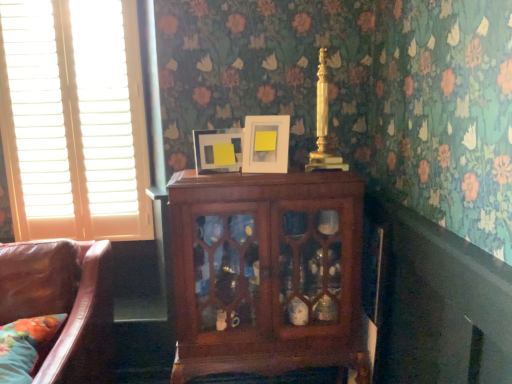
The height and width of the screenshot is (384, 512). What are the coordinates of `matte white picture frame at upper center, which is counted as the 1th picture frame, starting from the right` in the screenshot? It's located at (266, 144).

What is the approximate width of floral fabric pillow at lower left?

floral fabric pillow at lower left is 16.27 inches in width.

Measure the distance between point (311, 163) and camera.

A distance of 1.54 meters exists between point (311, 163) and camera.

What is the approximate width of gold polished candle holder at upper center?

It is 2.46 inches.

Identify the location of mahogany cabinet at center. (266, 272).

Where is `white wood blinds at left`? This screenshot has height=384, width=512. white wood blinds at left is located at coordinates (74, 119).

Consider the image. Does matte white picture frame at upper center, the 2th picture frame viewed from the left, have a lesser width compared to gold polished candle holder at upper center?

Incorrect, the width of matte white picture frame at upper center, the 2th picture frame viewed from the left, is not less than that of gold polished candle holder at upper center.

Is matte white picture frame at upper center, which is counted as the 1th picture frame, starting from the right, inside or outside of gold polished candle holder at upper center?

matte white picture frame at upper center, which is counted as the 1th picture frame, starting from the right, lies outside gold polished candle holder at upper center.

Considering the sizes of objects matte white picture frame at upper center, which is counted as the 1th picture frame, starting from the right, and gold polished candle holder at upper center in the image provided, who is taller, matte white picture frame at upper center, which is counted as the 1th picture frame, starting from the right, or gold polished candle holder at upper center?

gold polished candle holder at upper center.

Which is closer, (x=274, y=148) or (x=190, y=234)?

Point (x=274, y=148) appears to be farther away from the viewer than point (x=190, y=234).

Considering the relative positions of matte white picture frame at upper center, the 2th picture frame viewed from the left, and mahogany cabinet at center in the image provided, is matte white picture frame at upper center, the 2th picture frame viewed from the left, behind mahogany cabinet at center?

Yes, the depth of matte white picture frame at upper center, the 2th picture frame viewed from the left, is greater than that of mahogany cabinet at center.

Does matte white picture frame at upper center, which is counted as the 1th picture frame, starting from the right, have a larger size compared to mahogany cabinet at center?

Actually, matte white picture frame at upper center, which is counted as the 1th picture frame, starting from the right, might be smaller than mahogany cabinet at center.

Does matte white picture frame at upper center, which is counted as the 1th picture frame, starting from the right, have a greater width compared to mahogany cabinet at center?

No.

Does gold polished candle holder at upper center have a lesser width compared to matte white picture frame at upper center, which is counted as the 1th picture frame, starting from the right?

Yes, gold polished candle holder at upper center is thinner than matte white picture frame at upper center, which is counted as the 1th picture frame, starting from the right.

Looking at the image, does gold polished candle holder at upper center seem bigger or smaller compared to matte white picture frame at upper center, the 2th picture frame viewed from the left?

Considering their sizes, gold polished candle holder at upper center takes up less space than matte white picture frame at upper center, the 2th picture frame viewed from the left.

What's the angular difference between gold polished candle holder at upper center and matte white picture frame at upper center, the 2th picture frame viewed from the left,'s facing directions?

17.2 degrees.

Is point (323, 160) closer to camera compared to point (279, 167)?

That is False.

Between point (1, 361) and point (353, 324), which one is positioned in front?

The point (1, 361) is more forward.

Considering the relative positions of floral fabric pillow at lower left and mahogany cabinet at center in the image provided, is floral fabric pillow at lower left behind mahogany cabinet at center?

No.

In terms of width, does floral fabric pillow at lower left look wider or thinner when compared to mahogany cabinet at center?

Considering their sizes, floral fabric pillow at lower left looks broader than mahogany cabinet at center.

Between matte white picture frame at center, the first picture frame when ordered from left to right, and floral fabric pillow at lower left, which one is positioned in front?

Positioned in front is floral fabric pillow at lower left.

Does matte white picture frame at center, the first picture frame when ordered from left to right, have a greater width compared to floral fabric pillow at lower left?

Incorrect, the width of matte white picture frame at center, the first picture frame when ordered from left to right, does not surpass that of floral fabric pillow at lower left.

From the image's perspective, which one is positioned lower, matte white picture frame at center, arranged as the 2th picture frame when viewed from the right, or floral fabric pillow at lower left?

floral fabric pillow at lower left.

Is matte white picture frame at center, the first picture frame when ordered from left to right, directly adjacent to floral fabric pillow at lower left?

No, matte white picture frame at center, the first picture frame when ordered from left to right, is not beside floral fabric pillow at lower left.

In the scene shown: From the image's perspective, is white wood blinds at left on top of floral fabric pillow at lower left?

Yes, from the image's perspective, white wood blinds at left is on top of floral fabric pillow at lower left.

I want to click on pillow that is in front of the white wood blinds at left, so click(26, 346).

Is white wood blinds at left situated inside floral fabric pillow at lower left or outside?

white wood blinds at left cannot be found inside floral fabric pillow at lower left.

From their relative heights in the image, would you say white wood blinds at left is taller or shorter than floral fabric pillow at lower left?

Considering their sizes, white wood blinds at left has more height than floral fabric pillow at lower left.

Considering the sizes of floral fabric pillow at lower left and white wood blinds at left in the image, is floral fabric pillow at lower left taller or shorter than white wood blinds at left?

Considering their sizes, floral fabric pillow at lower left has less height than white wood blinds at left.

Looking at this image, from the image's perspective, is floral fabric pillow at lower left located above or below white wood blinds at left?

Based on their image positions, floral fabric pillow at lower left is located beneath white wood blinds at left.

Is floral fabric pillow at lower left looking in the opposite direction of white wood blinds at left?

floral fabric pillow at lower left does not have its back to white wood blinds at left.

Choose the correct answer: Is floral fabric pillow at lower left inside white wood blinds at left or outside it?

floral fabric pillow at lower left is not inside white wood blinds at left, it's outside.

Find the location of a particular element. candle holder lying on the right of matte white picture frame at upper center, which is counted as the 1th picture frame, starting from the right is located at coordinates (323, 126).

What are the coordinates of `shelf in front of the matte white picture frame at upper center, which is counted as the 1th picture frame, starting from the right` in the screenshot? It's located at (266, 272).

When comparing their distances from mahogany cabinet at center, does matte white picture frame at center, arranged as the 2th picture frame when viewed from the right, or floral fabric pillow at lower left seem further?

floral fabric pillow at lower left is positioned further to the anchor mahogany cabinet at center.

From the image, which object appears to be farther from white wood blinds at left, mahogany cabinet at center or matte white picture frame at upper center, which is counted as the 1th picture frame, starting from the right?

matte white picture frame at upper center, which is counted as the 1th picture frame, starting from the right, is further to white wood blinds at left.

From the picture: Considering their positions, is floral fabric pillow at lower left positioned closer to white wood blinds at left than matte white picture frame at upper center, the 2th picture frame viewed from the left?

matte white picture frame at upper center, the 2th picture frame viewed from the left, lies closer to white wood blinds at left than the other object.

Looking at the image, which one is located closer to floral fabric pillow at lower left, white wood blinds at left or gold polished candle holder at upper center?

The object closer to floral fabric pillow at lower left is white wood blinds at left.

Considering their positions, is gold polished candle holder at upper center positioned closer to matte white picture frame at upper center, the 2th picture frame viewed from the left, than mahogany cabinet at center?

gold polished candle holder at upper center lies closer to matte white picture frame at upper center, the 2th picture frame viewed from the left, than the other object.

Which object lies further to the anchor point matte white picture frame at center, arranged as the 2th picture frame when viewed from the right, matte white picture frame at upper center, which is counted as the 1th picture frame, starting from the right, or mahogany cabinet at center?

mahogany cabinet at center.

Looking at the image, which one is located further to white wood blinds at left, matte white picture frame at upper center, the 2th picture frame viewed from the left, or mahogany cabinet at center?

The object further to white wood blinds at left is matte white picture frame at upper center, the 2th picture frame viewed from the left.

Looking at the image, which one is located further to matte white picture frame at center, arranged as the 2th picture frame when viewed from the right, floral fabric pillow at lower left or mahogany cabinet at center?

floral fabric pillow at lower left lies further to matte white picture frame at center, arranged as the 2th picture frame when viewed from the right, than the other object.

Locate an element on the screen. This screenshot has width=512, height=384. picture frame situated between floral fabric pillow at lower left and matte white picture frame at upper center, the 2th picture frame viewed from the left, from left to right is located at coordinates coord(214,150).

Identify the location of pillow between white wood blinds at left and mahogany cabinet at center from left to right. This screenshot has width=512, height=384. [26, 346].

Image resolution: width=512 pixels, height=384 pixels. I want to click on picture frame between matte white picture frame at center, the first picture frame when ordered from left to right, and gold polished candle holder at upper center, in the horizontal direction, so click(266, 144).

I want to click on picture frame between matte white picture frame at upper center, which is counted as the 1th picture frame, starting from the right, and mahogany cabinet at center, in the vertical direction, so click(x=214, y=150).